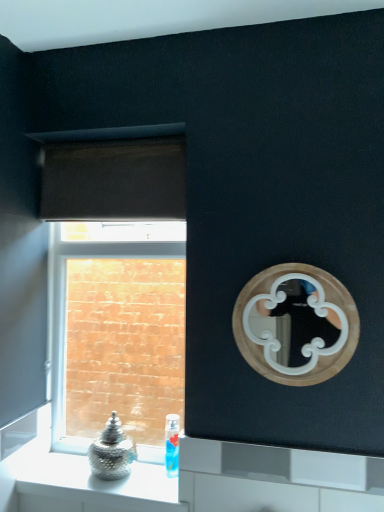
Question: Should I look upward or downward to see brick textured wall at left?

Choices:
 (A) down
 (B) up

Answer: (A)

Question: Does metallic glass jar at lower left have a larger size compared to brick textured wall at left?

Choices:
 (A) yes
 (B) no

Answer: (B)

Question: Could brick textured wall at left be considered to be inside metallic glass jar at lower left?

Choices:
 (A) no
 (B) yes

Answer: (A)

Question: Does metallic glass jar at lower left have a lesser width compared to brick textured wall at left?

Choices:
 (A) yes
 (B) no

Answer: (B)

Question: Can you confirm if metallic glass jar at lower left is wider than brick textured wall at left?

Choices:
 (A) yes
 (B) no

Answer: (A)

Question: Could you tell me if metallic glass jar at lower left is turned towards brick textured wall at left?

Choices:
 (A) no
 (B) yes

Answer: (A)

Question: From the image's perspective, is metallic glass jar at lower left below brick textured wall at left?

Choices:
 (A) no
 (B) yes

Answer: (B)

Question: Considering the relative sizes of metallic glass jar at lower left and wooden mirror at upper right in the image provided, is metallic glass jar at lower left thinner than wooden mirror at upper right?

Choices:
 (A) yes
 (B) no

Answer: (B)

Question: Is metallic glass jar at lower left shorter than wooden mirror at upper right?

Choices:
 (A) yes
 (B) no

Answer: (A)

Question: From a real-world perspective, is metallic glass jar at lower left beneath wooden mirror at upper right?

Choices:
 (A) no
 (B) yes

Answer: (B)

Question: Is metallic glass jar at lower left at the right side of wooden mirror at upper right?

Choices:
 (A) yes
 (B) no

Answer: (B)

Question: Is metallic glass jar at lower left closer to the viewer compared to wooden mirror at upper right?

Choices:
 (A) yes
 (B) no

Answer: (B)

Question: Are metallic glass jar at lower left and wooden mirror at upper right beside each other?

Choices:
 (A) no
 (B) yes

Answer: (A)

Question: Is brown fabric curtain at upper left looking in the opposite direction of translucent plastic bottle at lower center?

Choices:
 (A) no
 (B) yes

Answer: (A)